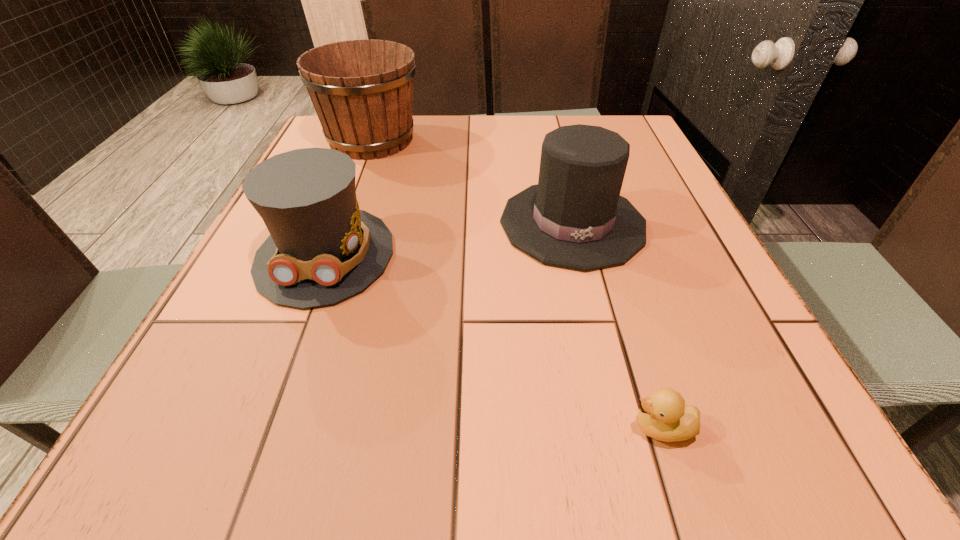
In the image, there is a desktop. At what (x,y) coordinates should I click in order to perform the action: click on vacant space at the near edge. Please return your answer as a coordinate pair (x, y). This screenshot has width=960, height=540. Looking at the image, I should click on (264, 456).

In the image, there is a desktop. Identify the location of blank space at the left edge. (245, 311).

Find the location of a particular element. The image size is (960, 540). free space at the right edge of the desktop is located at coordinates (679, 213).

In order to click on vacant space in between the right dress hat and the left dress hat in this screenshot , I will do `click(449, 239)`.

This screenshot has height=540, width=960. I want to click on free space between the left dress hat and the right dress hat, so click(x=449, y=239).

The image size is (960, 540). Find the location of `empty space that is in between the duckling and the left dress hat`. empty space that is in between the duckling and the left dress hat is located at coordinates (493, 341).

This screenshot has height=540, width=960. In order to click on vacant area that lies between the right dress hat and the duckling in this screenshot , I will do `click(617, 326)`.

You are a GUI agent. You are given a task and a screenshot of the screen. Output one action in this format:
    pyautogui.click(x=<x>, y=<y>)
    Task: Click on the vacant space that is in between the right dress hat and the duckling
    The height and width of the screenshot is (540, 960).
    Given the screenshot: What is the action you would take?
    pyautogui.click(x=617, y=326)

You are a GUI agent. You are given a task and a screenshot of the screen. Output one action in this format:
    pyautogui.click(x=<x>, y=<y>)
    Task: Click on the free spot between the shortest object and the right dress hat
    The image size is (960, 540).
    Given the screenshot: What is the action you would take?
    pyautogui.click(x=617, y=326)

Where is `vacant space that's between the left dress hat and the duckling`? Image resolution: width=960 pixels, height=540 pixels. vacant space that's between the left dress hat and the duckling is located at coordinates (493, 341).